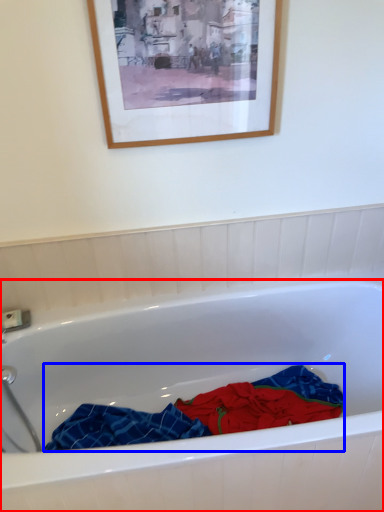
Question: Which object is closer to the camera taking this photo, bathtub (highlighted by a red box) or material (highlighted by a blue box)?

Choices:
 (A) bathtub
 (B) material

Answer: (A)